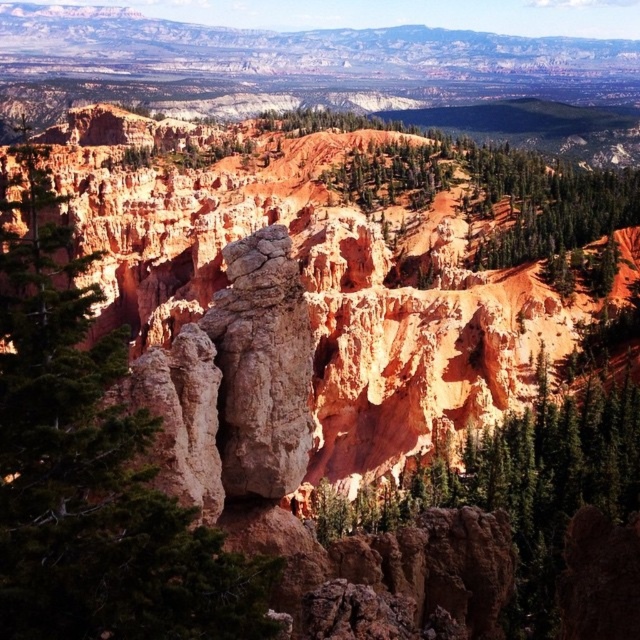
You are an environmental scientist assessing the biodiversity of this desert landscape. You observe the green matte tree at left and the green textured tree at upper center. Which tree would you prioritize for soil sample collection if you want to analyze the soil that supports taller vegetation?

The green matte tree at left is taller than the green textured tree at upper center, so you should prioritize collecting soil samples from around the green matte tree at left to analyze the soil that supports taller vegetation.

You are planning to plant a new tree in this desert landscape. The green matte tree at left and the green textured tree at upper center are already present. Which existing tree has a wider canopy to provide more shade?

The green matte tree at left has a wider canopy than the green textured tree at upper center, so it provides more shade.